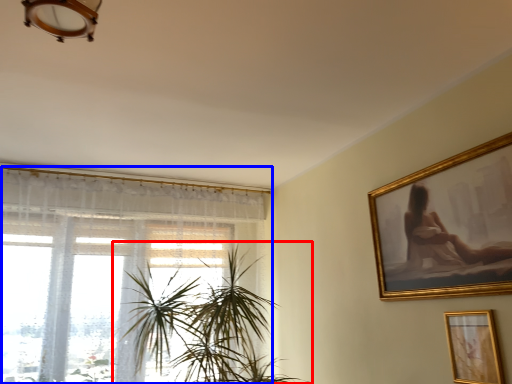
Question: Which object appears closest to the camera in this image, houseplant (highlighted by a red box) or window (highlighted by a blue box)?

Choices:
 (A) houseplant
 (B) window

Answer: (A)